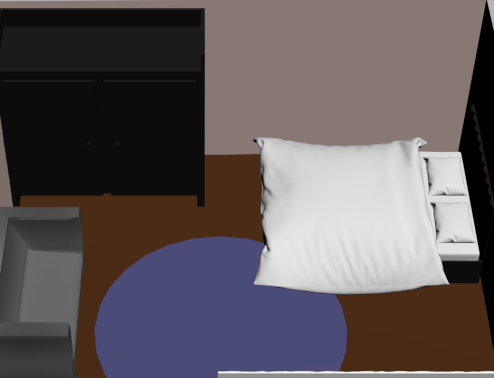
The width and height of the screenshot is (494, 378). I want to click on white comforter, so click(344, 225).